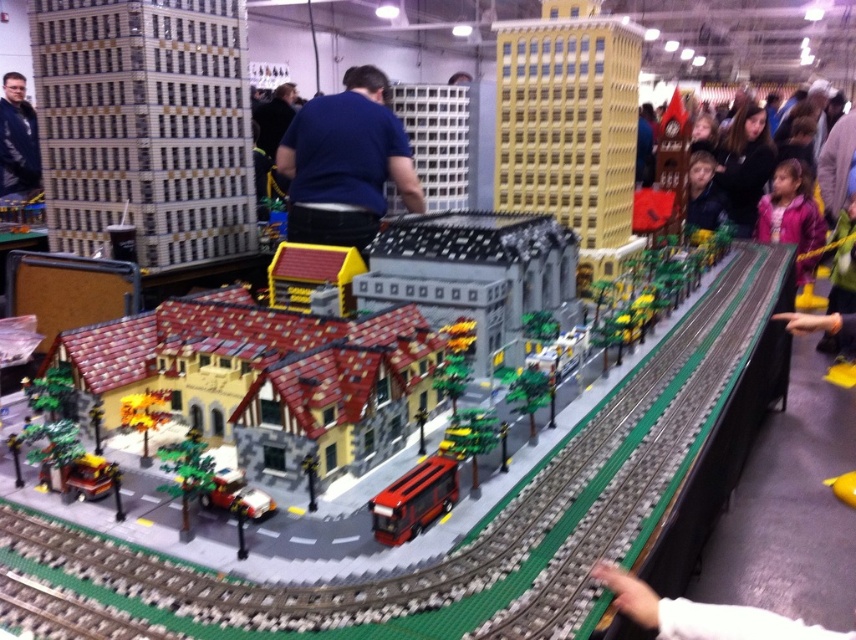
Question: Which of the following is the farthest from the observer?

Choices:
 (A) (369, 177)
 (B) (783, 212)
 (C) (30, 120)

Answer: (C)

Question: Is shiny red bus at center further to camera compared to pink fleece jacket at upper right?

Choices:
 (A) no
 (B) yes

Answer: (A)

Question: Observing the image, what is the correct spatial positioning of pink fleece jacket at upper right in reference to leather jacket at left?

Choices:
 (A) right
 (B) left

Answer: (A)

Question: Which of these objects is positioned closest to the blue fabric shirt at center?

Choices:
 (A) pink fleece jacket at upper right
 (B) leather jacket at left

Answer: (A)

Question: From the image, what is the correct spatial relationship of blue fabric shirt at center in relation to pink fleece jacket at upper right?

Choices:
 (A) below
 (B) above

Answer: (B)

Question: Among these points, which one is farthest from the camera?

Choices:
 (A) (379, 220)
 (B) (437, 474)
 (C) (819, 216)
 (D) (18, 180)

Answer: (D)